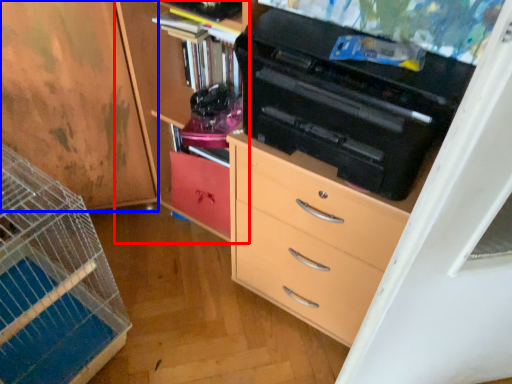
Question: Which object is closer to the camera taking this photo, cabinetry (highlighted by a red box) or cabinetry (highlighted by a blue box)?

Choices:
 (A) cabinetry
 (B) cabinetry

Answer: (A)